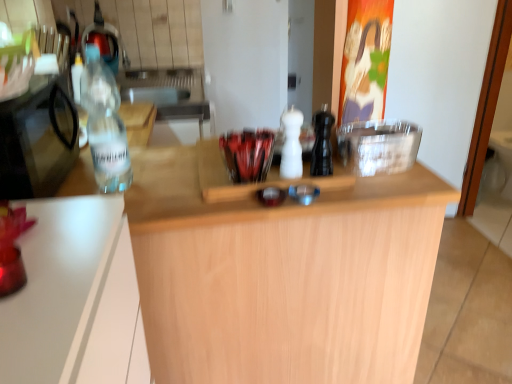
Locate an element on the screen. vacant area that is in front of black matte pepper grinder at center, marked as the third bottle in a left-to-right arrangement is located at coordinates (330, 185).